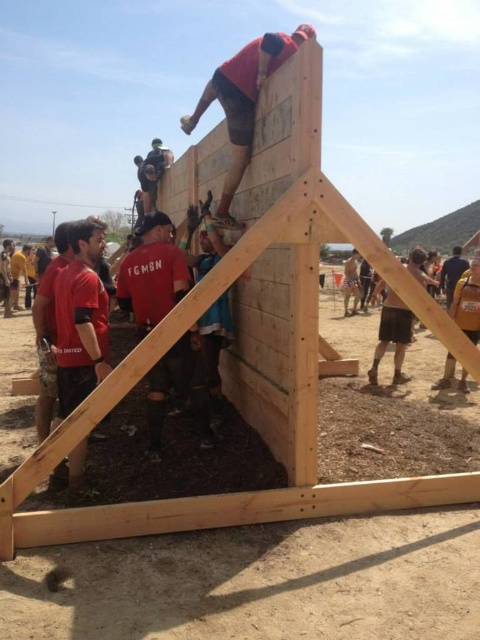
Question: Is matte red shirt at center above yellow fabric shirt at lower left?

Choices:
 (A) no
 (B) yes

Answer: (A)

Question: Can you confirm if matte red shirt at center is positioned to the right of yellow fabric shirt at lower left?

Choices:
 (A) no
 (B) yes

Answer: (B)

Question: Which object appears farthest from the camera in this image?

Choices:
 (A) matte red shirt at center
 (B) yellow fabric shirt at lower left

Answer: (B)

Question: Among these objects, which one is farthest from the camera?

Choices:
 (A) yellow fabric shirt at lower left
 (B) matte red shirt at center

Answer: (A)

Question: Which point is closer to the camera taking this photo?

Choices:
 (A) (235, 100)
 (B) (136, 260)

Answer: (B)

Question: Can you confirm if matte red shirt at center is positioned above dark blue jeans at right?

Choices:
 (A) no
 (B) yes

Answer: (A)